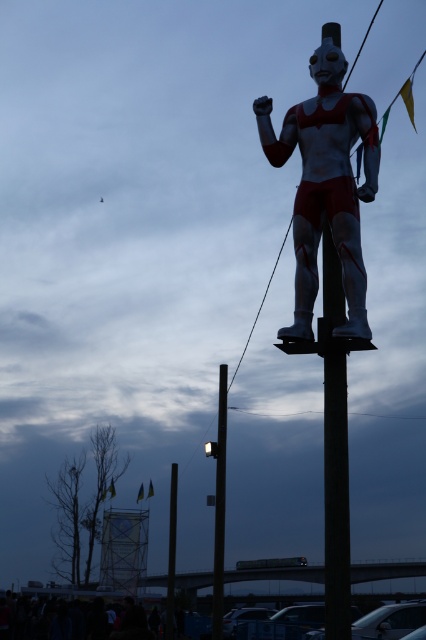
Between smooth wood telegraph pole at center and black smooth pole at center, which one has more height?

Standing taller between the two is black smooth pole at center.

Which is below, smooth wood telegraph pole at center or black smooth pole at center?

black smooth pole at center is below.

Who is more forward, (334, 392) or (172, 500)?

Point (334, 392) is more forward.

This screenshot has width=426, height=640. Find the location of `smooth wood telegraph pole at center`. smooth wood telegraph pole at center is located at coordinates (334, 451).

How much distance is there between metallic silver figure at center and smooth wood telegraph pole at center?

metallic silver figure at center and smooth wood telegraph pole at center are 5.90 feet apart from each other.

Who is shorter, metallic silver figure at center or smooth wood telegraph pole at center?

metallic silver figure at center is shorter.

The height and width of the screenshot is (640, 426). I want to click on metallic silver figure at center, so click(325, 184).

Is point (293, 106) positioned in front of point (209, 449)?

Yes, point (293, 106) is in front of point (209, 449).

Is metallic silver figure at center thinner than metallic pole at center?

Indeed, metallic silver figure at center has a lesser width compared to metallic pole at center.

Is point (367, 180) positioned in front of point (219, 636)?

Yes, point (367, 180) is closer to viewer.

Identify the location of metallic silver figure at center. This screenshot has height=640, width=426. (325, 184).